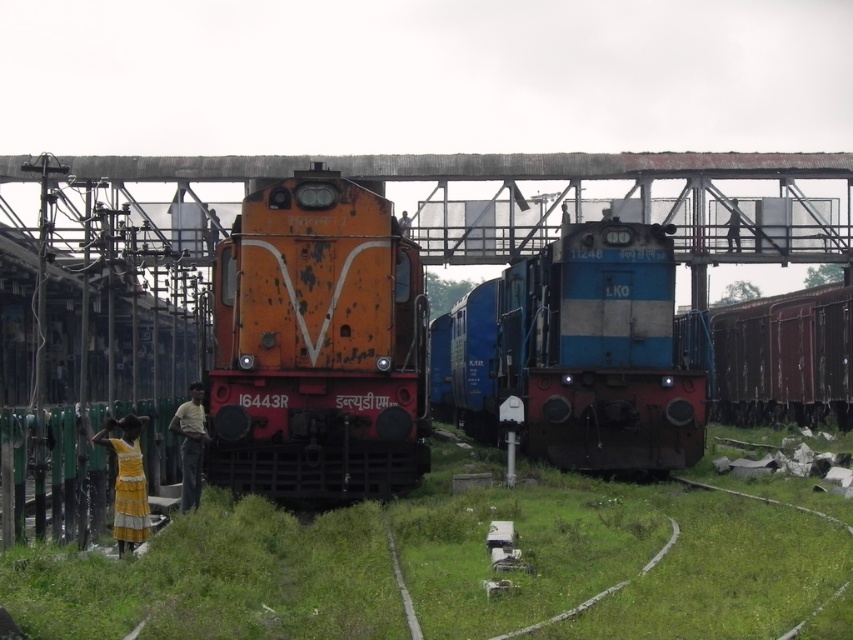
Question: Considering the real-world distances, which object is farthest from the blue metallic train at center?

Choices:
 (A) rusty metal train at center
 (B) light brown fabric shirt at lower left

Answer: (B)

Question: Estimate the real-world distances between objects in this image. Which object is closer to the metallic bridge at upper center?

Choices:
 (A) light brown fabric shirt at lower left
 (B) blue metallic train at center
 (C) rusty metal train at center

Answer: (C)

Question: Does rusty metal train at center appear on the right side of metallic bridge at upper center?

Choices:
 (A) no
 (B) yes

Answer: (B)

Question: Is the position of metallic bridge at upper center less distant than that of light brown fabric shirt at lower left?

Choices:
 (A) no
 (B) yes

Answer: (A)

Question: Which point is farther to the camera?

Choices:
 (A) light brown fabric shirt at lower left
 (B) blue metallic train at center
 (C) metallic bridge at upper center

Answer: (B)

Question: Can you confirm if rusty metal train at center is positioned above blue metallic train at center?

Choices:
 (A) yes
 (B) no

Answer: (A)